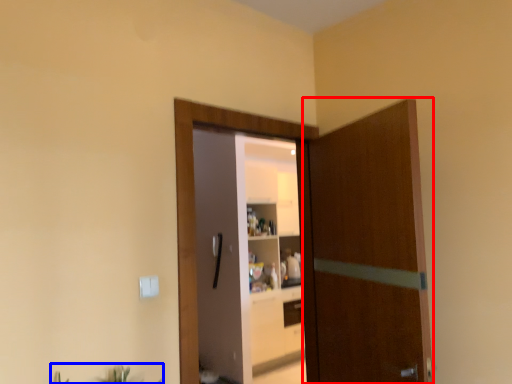
Question: Which of the following is the closest to the observer, door (highlighted by a red box) or plant (highlighted by a blue box)?

Choices:
 (A) door
 (B) plant

Answer: (B)